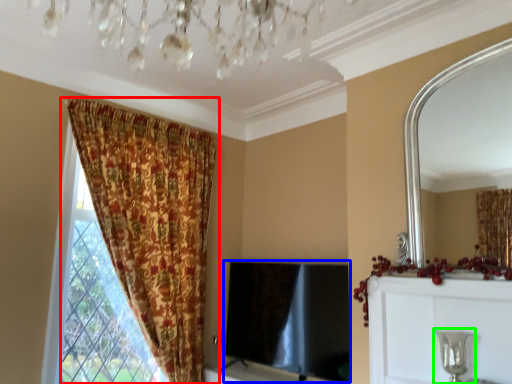
Question: Which object is the closest to the curtain (highlighted by a red box)? Choose among these: window screen (highlighted by a blue box) or candle holder (highlighted by a green box).

Choices:
 (A) window screen
 (B) candle holder

Answer: (A)